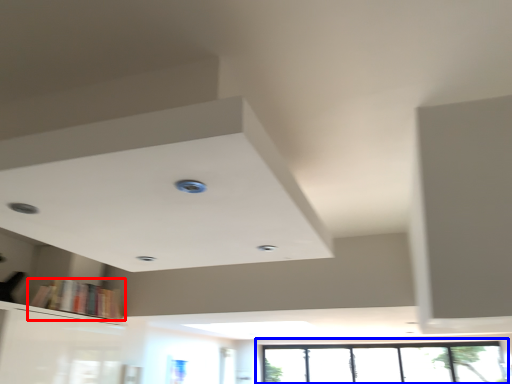
Question: Which point is closer to the camera, book (highlighted by a red box) or window (highlighted by a blue box)?

Choices:
 (A) book
 (B) window

Answer: (A)